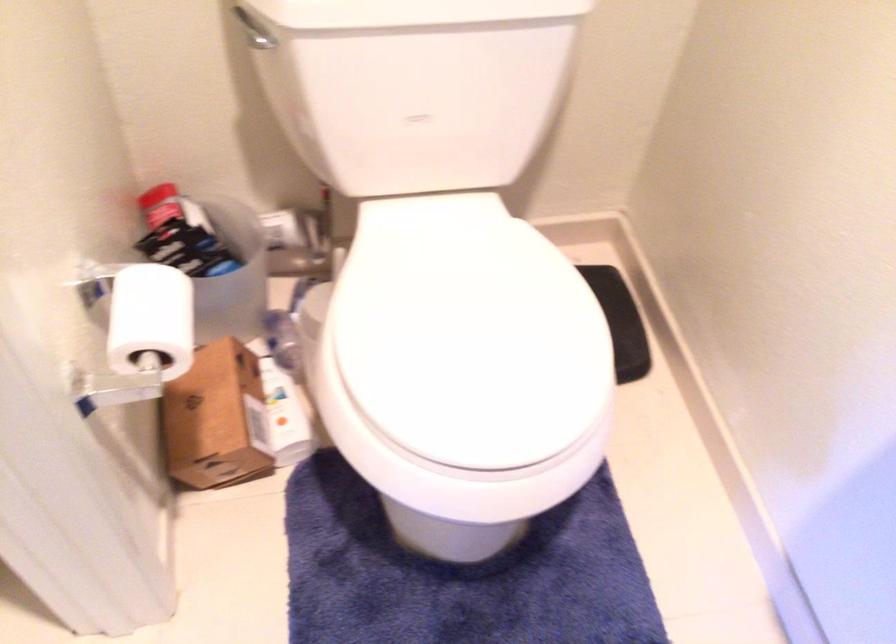
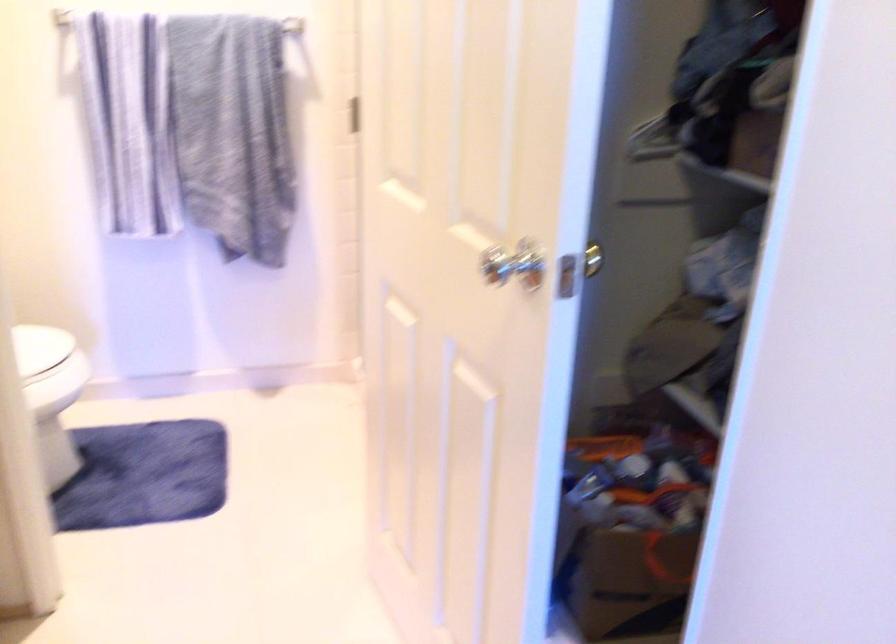
Locate, in the second image, the point that corresponds to (394,433) in the first image.

(45, 368)